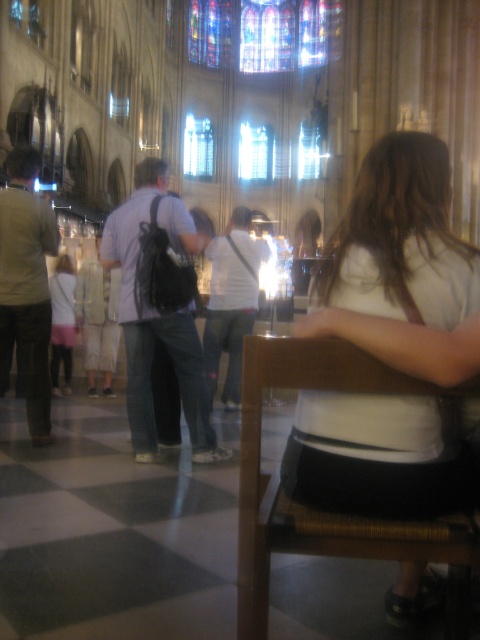
You are standing in the cathedral and want to sit down. There is a brown woven chair at center and a white cotton shirt at lower left. Which object can you sit on?

The brown woven chair at center is larger in size than the white cotton shirt at lower left, so you can sit on the brown woven chair at center.

You are standing in the cathedral and want to take a photo of the brown woven chair at center and the white cotton shirt at lower left. Which object should you focus on first if you want to capture both in a single frame without moving the camera?

You should focus on the brown woven chair at center first because it is closer to the viewer than the white cotton shirt at lower left, ensuring both are in focus when using a camera with a fixed focal point.